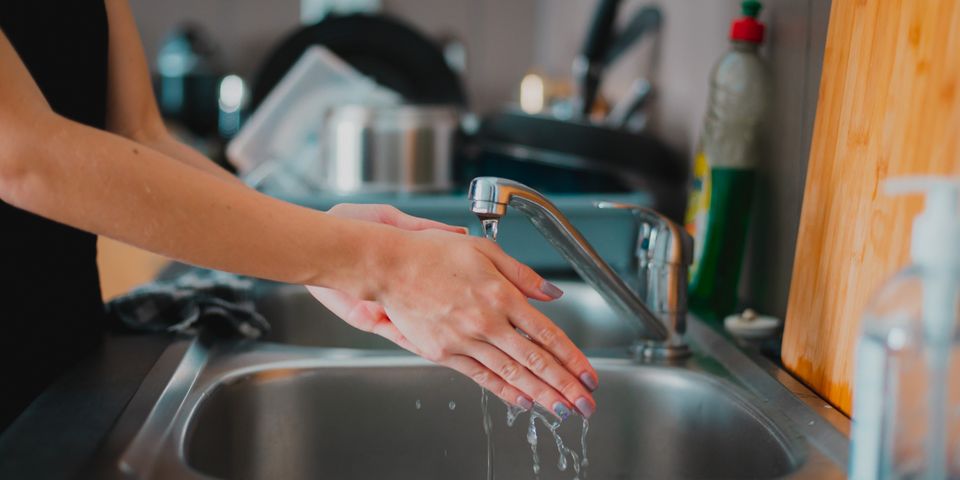
At what (x,y) coordinates should I click in order to perform the action: click on bottles. Please return your answer as a coordinate pair (x, y). Looking at the image, I should click on (744, 94), (944, 357).